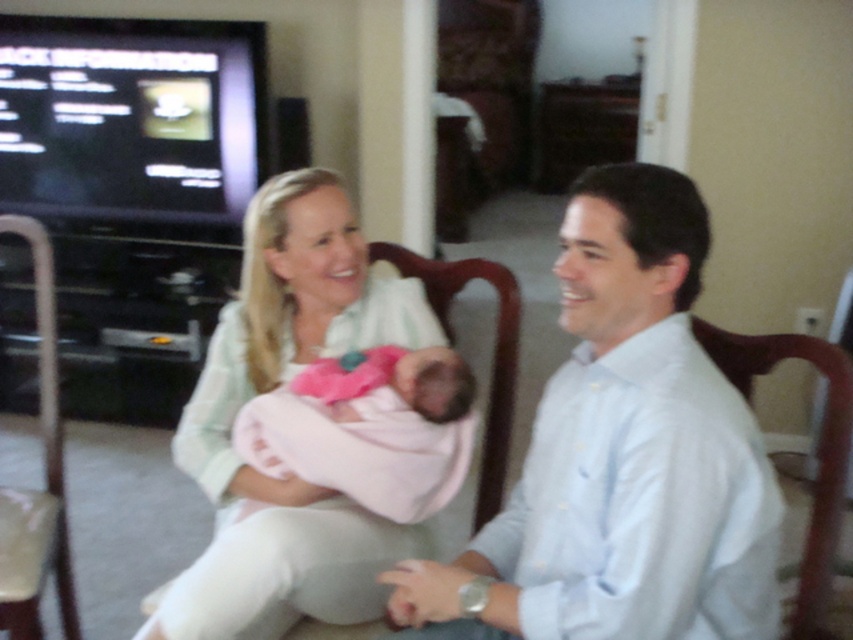
Does light green fabric shirt at center appear over dark wood armchair at right?

Correct, light green fabric shirt at center is located above dark wood armchair at right.

Between light green fabric shirt at center and dark wood armchair at right, which one is positioned lower?

dark wood armchair at right is lower down.

Between point (265, 548) and point (811, 349), which one is positioned in front?

Positioned in front is point (265, 548).

Where is `light green fabric shirt at center`? Image resolution: width=853 pixels, height=640 pixels. light green fabric shirt at center is located at coordinates (273, 387).

The height and width of the screenshot is (640, 853). I want to click on light green fabric shirt at center, so click(x=273, y=387).

Is light green fabric shirt at center further to camera compared to light brown leather armchair at left?

That is False.

Where is `light green fabric shirt at center`? light green fabric shirt at center is located at coordinates (273, 387).

Is light blue shirt at right further to the viewer compared to dark wood armchair at right?

That is False.

Is point (479, 624) positioned after point (793, 346)?

No.

This screenshot has width=853, height=640. In order to click on light blue shirt at right in this screenshot , I will do `click(621, 456)`.

Where is `light blue shirt at right`? This screenshot has height=640, width=853. light blue shirt at right is located at coordinates (621, 456).